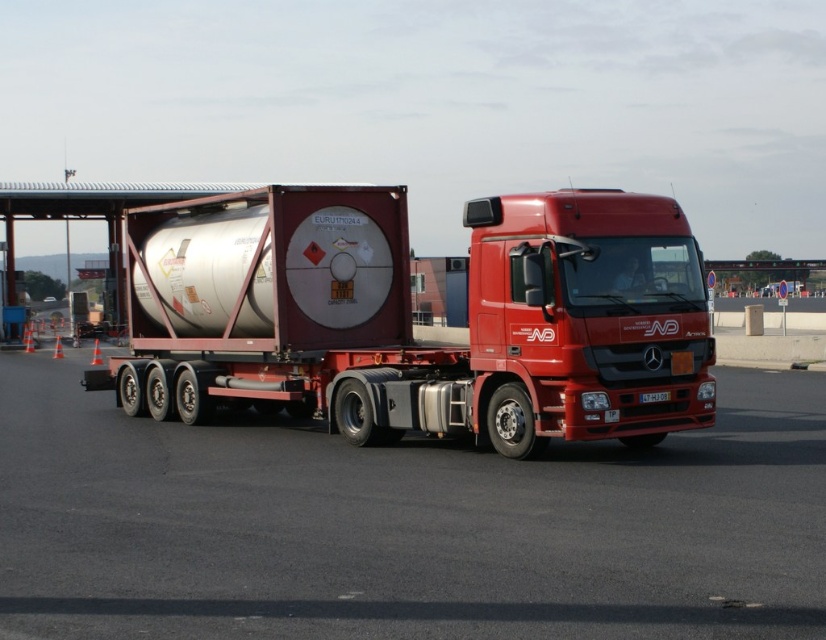
Is metallic asphalt at center to the left of metallic silver tank at center from the viewer's perspective?

No, metallic asphalt at center is not to the left of metallic silver tank at center.

Between point (228, 515) and point (171, 310), which one is positioned in front?

Point (228, 515)

Locate an element on the screen. metallic asphalt at center is located at coordinates (404, 525).